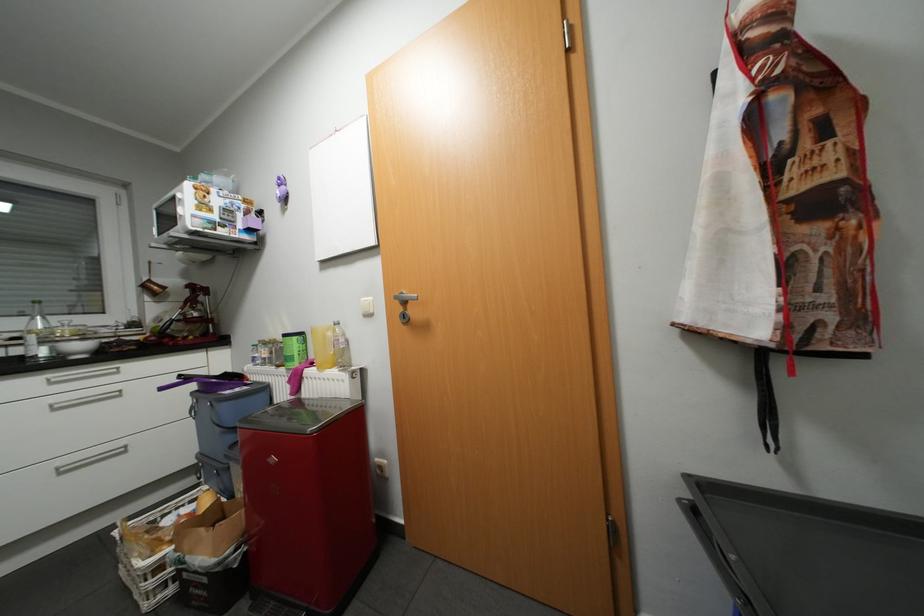
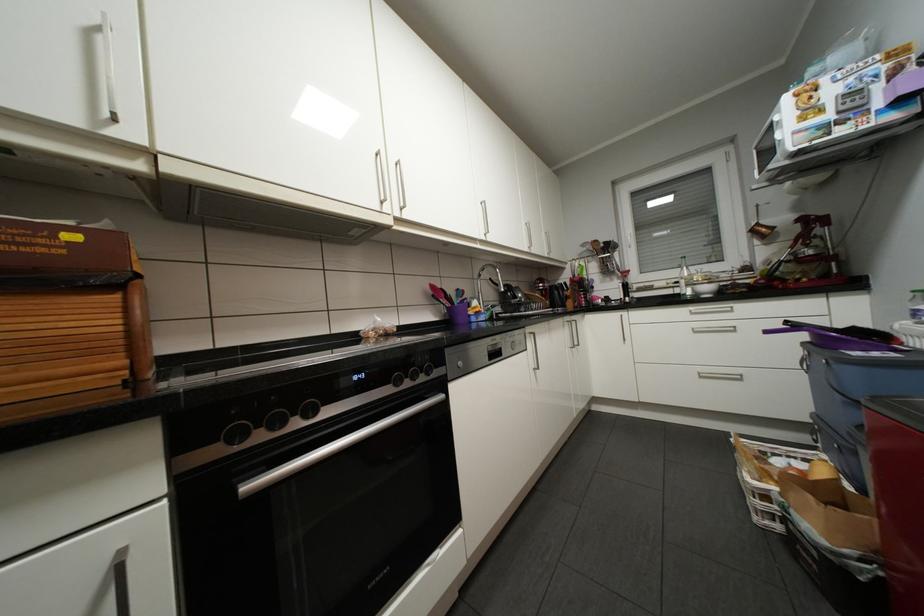
Find the pixel in the second image that matches (x=69, y=472) in the first image.

(709, 377)